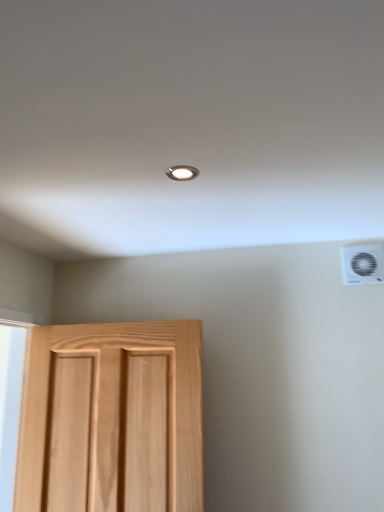
Question: Does point (144, 474) appear closer or farther from the camera than point (344, 275)?

Choices:
 (A) farther
 (B) closer

Answer: (B)

Question: Considering the positions of natural wood door at lower left and white plastic air conditioning unit at upper right in the image, is natural wood door at lower left taller or shorter than white plastic air conditioning unit at upper right?

Choices:
 (A) short
 (B) tall

Answer: (B)

Question: Considering their positions, is natural wood door at lower left located in front of or behind white plastic air conditioning unit at upper right?

Choices:
 (A) front
 (B) behind

Answer: (A)

Question: Is white plastic air conditioning unit at upper right spatially inside natural wood door at lower left, or outside of it?

Choices:
 (A) inside
 (B) outside

Answer: (B)

Question: Would you say white plastic air conditioning unit at upper right is to the left or to the right of natural wood door at lower left in the picture?

Choices:
 (A) right
 (B) left

Answer: (A)

Question: From a real-world perspective, is white plastic air conditioning unit at upper right above or below natural wood door at lower left?

Choices:
 (A) above
 (B) below

Answer: (A)

Question: In the image, is white plastic air conditioning unit at upper right positioned in front of or behind natural wood door at lower left?

Choices:
 (A) behind
 (B) front

Answer: (A)